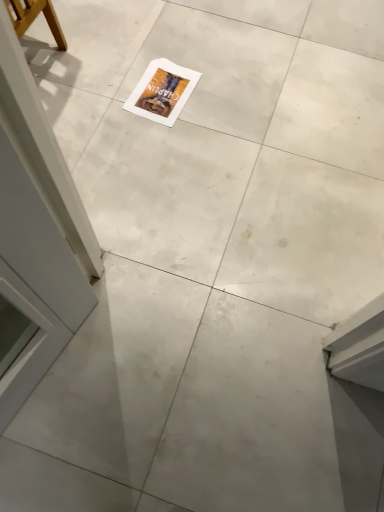
This screenshot has height=512, width=384. Find the location of `blank space to the left of white paper postcard at center`. blank space to the left of white paper postcard at center is located at coordinates (100, 78).